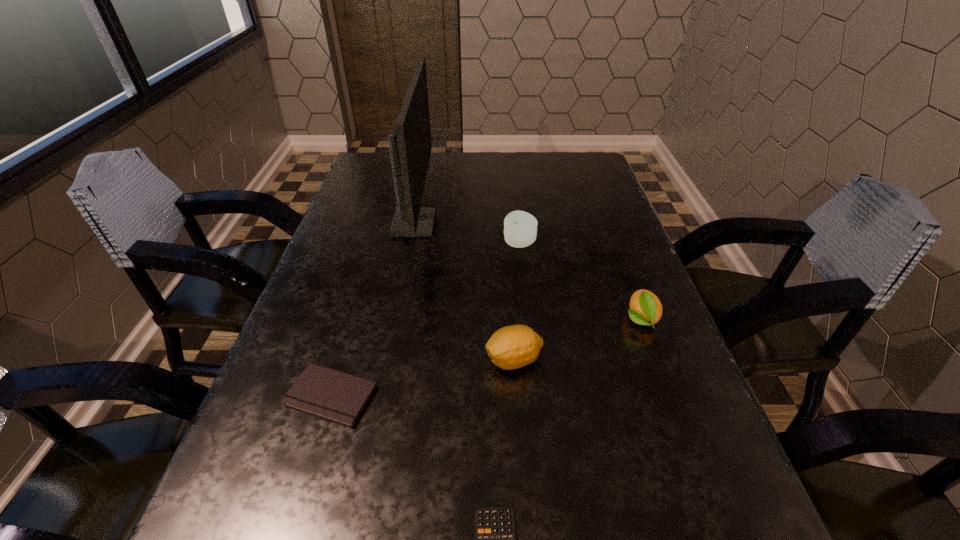
At what (x,y) coordinates should I click in order to perform the action: click on vacant area that lies between the computer monitor and the apple. Please return your answer as a coordinate pair (x, y). Image resolution: width=960 pixels, height=540 pixels. Looking at the image, I should click on (467, 233).

Where is `vacant space that's between the computer monitor and the fourth nearest object`? The width and height of the screenshot is (960, 540). vacant space that's between the computer monitor and the fourth nearest object is located at coordinates (527, 271).

At what (x,y) coordinates should I click in order to perform the action: click on free space that is in between the computer monitor and the second shortest object. Please return your answer as a coordinate pair (x, y). The image size is (960, 540). Looking at the image, I should click on (372, 309).

Image resolution: width=960 pixels, height=540 pixels. What are the coordinates of `free space between the farther lemon and the computer monitor` in the screenshot? It's located at (527, 271).

Where is `free area in between the fifth tallest object and the rightmost object`? This screenshot has width=960, height=540. free area in between the fifth tallest object and the rightmost object is located at coordinates (486, 357).

Find the location of a particular element. The image size is (960, 540). free space between the left lemon and the apple is located at coordinates (516, 302).

The height and width of the screenshot is (540, 960). I want to click on free spot between the apple and the left lemon, so click(x=516, y=302).

Image resolution: width=960 pixels, height=540 pixels. Identify the location of free space between the farther lemon and the tallest object. (527, 271).

Find the location of `the fourth closest object relative to the farther lemon`. the fourth closest object relative to the farther lemon is located at coordinates (410, 150).

Locate which object ranks fourth in proximity to the left lemon. Please provide its 2D coordinates. Your answer should be formatted as a tuple, i.e. [(x, y)], where the tuple contains the x and y coordinates of a point satisfying the conditions above.

[(410, 150)]